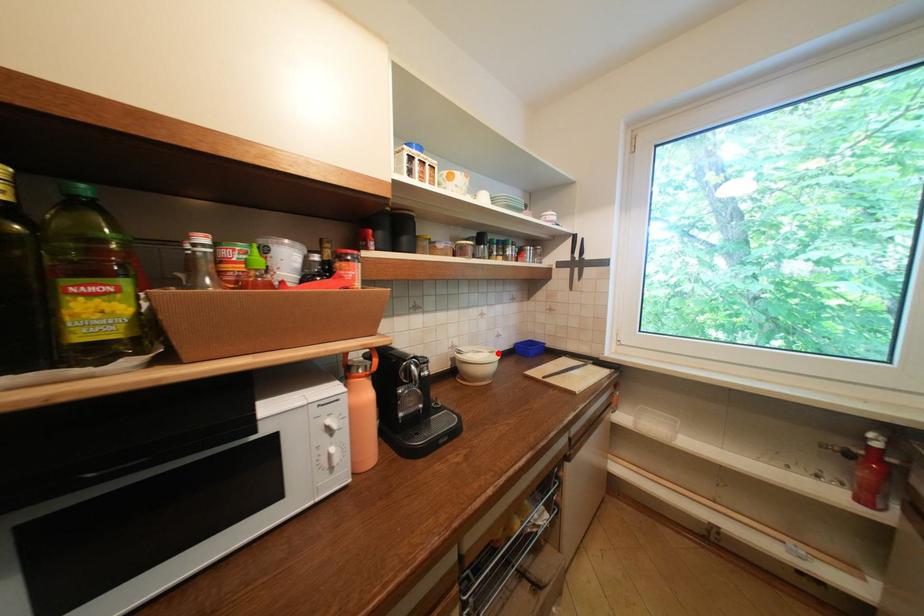
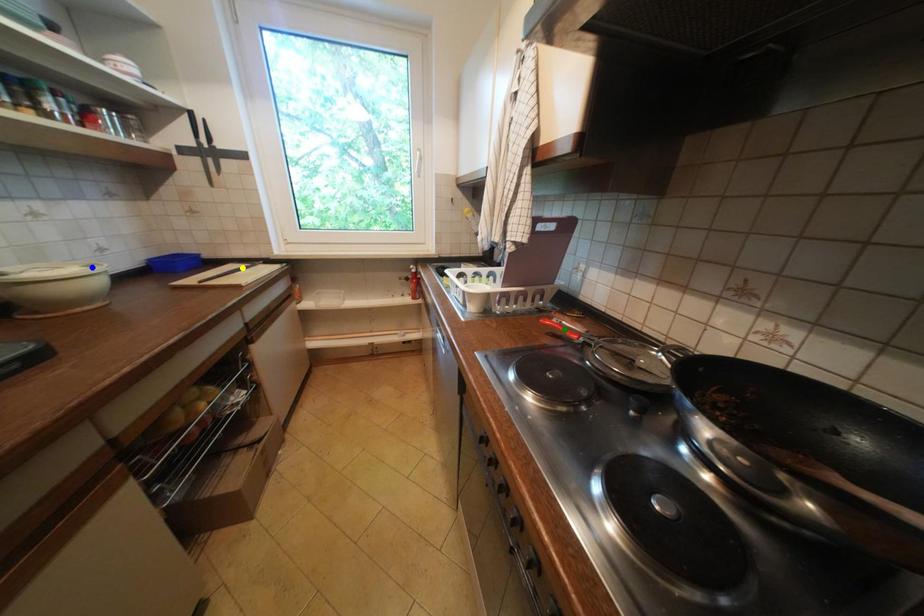
Question: I am providing you with two images of the same scene from different viewpoints. A red point is marked on the first image. You are given multiple points on the second image. Which mark in image 2 goes with the point in image 1?

Choices:
 (A) yellow point
 (B) blue point
 (C) green point

Answer: (B)